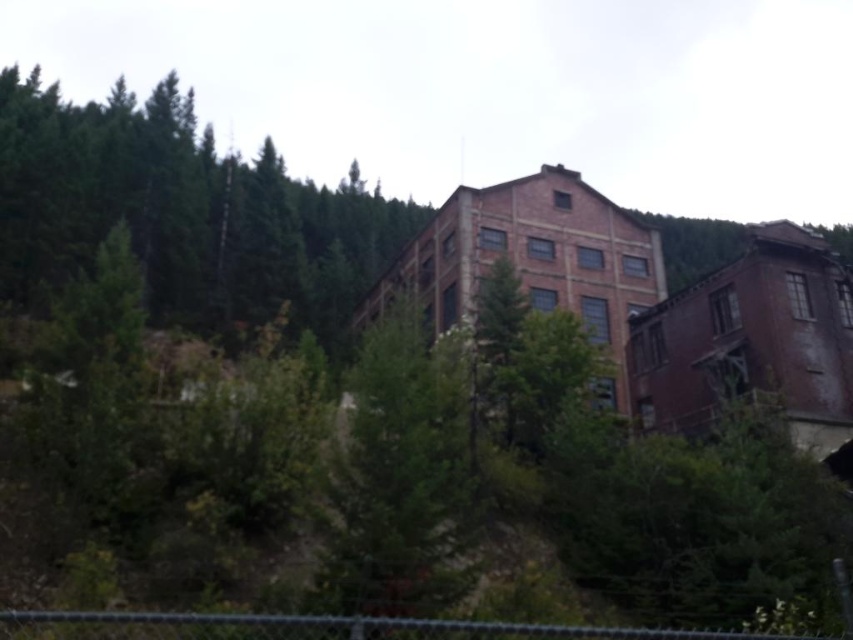
Question: Does green matte tree at upper left appear over green leafy tree at center?

Choices:
 (A) yes
 (B) no

Answer: (A)

Question: In this image, where is green matte tree at upper left located relative to chain-link fence at lower center?

Choices:
 (A) right
 (B) left

Answer: (B)

Question: Which of the following is the closest to the observer?

Choices:
 (A) green leafy tree at center
 (B) green matte tree at upper left
 (C) chain-link fence at lower center

Answer: (C)

Question: Does green matte tree at upper left appear under chain-link fence at lower center?

Choices:
 (A) yes
 (B) no

Answer: (B)

Question: Which of the following is the closest to the observer?

Choices:
 (A) green matte tree at upper left
 (B) chain-link fence at lower center

Answer: (B)

Question: Which point is closer to the camera?

Choices:
 (A) (126, 112)
 (B) (572, 636)

Answer: (B)